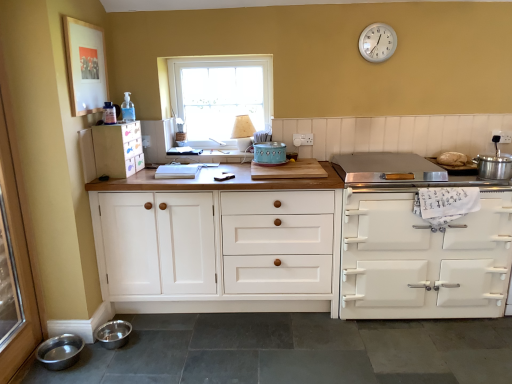
Question: Considering the relative sizes of white wood cabinet at center, the 2th cabinetry in the left-to-right sequence, and stainless steel cooker at right, which is the 2th appliance from right to left, in the image provided, is white wood cabinet at center, the 2th cabinetry in the left-to-right sequence, shorter than stainless steel cooker at right, which is the 2th appliance from right to left,?

Choices:
 (A) yes
 (B) no

Answer: (B)

Question: Is white wood cabinet at center, which is the 2th cabinetry in right-to-left order, oriented away from stainless steel cooker at right, which is the 2th appliance from right to left?

Choices:
 (A) no
 (B) yes

Answer: (A)

Question: Does white wood cabinet at center, the 2th cabinetry in the left-to-right sequence, turn towards stainless steel cooker at right, which is the 2th appliance from right to left?

Choices:
 (A) no
 (B) yes

Answer: (A)

Question: Does white wood cabinet at center, which is the 2th cabinetry in right-to-left order, have a greater height compared to stainless steel cooker at right, which is the 2th appliance from right to left?

Choices:
 (A) yes
 (B) no

Answer: (A)

Question: Is white wood cabinet at center, which is the 2th cabinetry in right-to-left order, placed right next to stainless steel cooker at right, which is the 2th appliance from right to left?

Choices:
 (A) no
 (B) yes

Answer: (A)

Question: In the image, is stainless steel bowl at lower left, placed as the 1th bowl when sorted from left to right, positioned in front of or behind teal ceramic pot at center, acting as the third appliance starting from the right?

Choices:
 (A) front
 (B) behind

Answer: (A)

Question: Does point (48, 362) appear closer or farther from the camera than point (259, 162)?

Choices:
 (A) farther
 (B) closer

Answer: (B)

Question: From a real-world perspective, is stainless steel bowl at lower left, positioned as the 2th bowl in right-to-left order, positioned above or below teal ceramic pot at center, acting as the third appliance starting from the right?

Choices:
 (A) below
 (B) above

Answer: (A)

Question: Choose the correct answer: Is stainless steel bowl at lower left, positioned as the 2th bowl in right-to-left order, inside teal ceramic pot at center, positioned as the first appliance in left-to-right order, or outside it?

Choices:
 (A) outside
 (B) inside

Answer: (A)

Question: In the image, is stainless steel cooker at right, positioned as the second appliance in left-to-right order, positioned in front of or behind teal ceramic pot at center, acting as the third appliance starting from the right?

Choices:
 (A) front
 (B) behind

Answer: (A)

Question: Looking at their shapes, would you say stainless steel cooker at right, positioned as the second appliance in left-to-right order, is wider or thinner than teal ceramic pot at center, positioned as the first appliance in left-to-right order?

Choices:
 (A) thin
 (B) wide

Answer: (B)

Question: In terms of size, does stainless steel cooker at right, which is the 2th appliance from right to left, appear bigger or smaller than teal ceramic pot at center, positioned as the first appliance in left-to-right order?

Choices:
 (A) small
 (B) big

Answer: (B)

Question: From a real-world perspective, is stainless steel cooker at right, which is the 2th appliance from right to left, positioned above or below teal ceramic pot at center, acting as the third appliance starting from the right?

Choices:
 (A) below
 (B) above

Answer: (A)

Question: Considering their positions, is transparent glass screen door at left located in front of or behind white glossy stove at right, which ranks as the 3th cabinetry in left-to-right order?

Choices:
 (A) front
 (B) behind

Answer: (A)

Question: From a real-world perspective, relative to white glossy stove at right, which ranks as the 3th cabinetry in left-to-right order, is transparent glass screen door at left vertically above or below?

Choices:
 (A) above
 (B) below

Answer: (A)